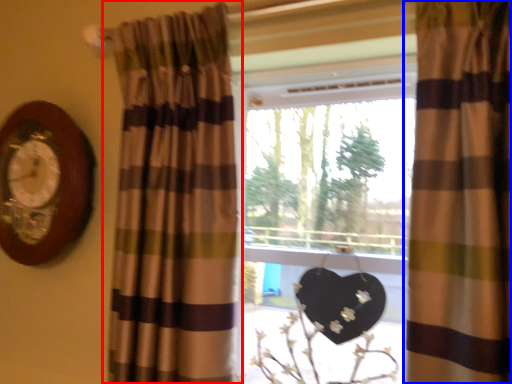
Question: Which point is closer to the camera, curtain (highlighted by a red box) or curtain (highlighted by a blue box)?

Choices:
 (A) curtain
 (B) curtain

Answer: (B)